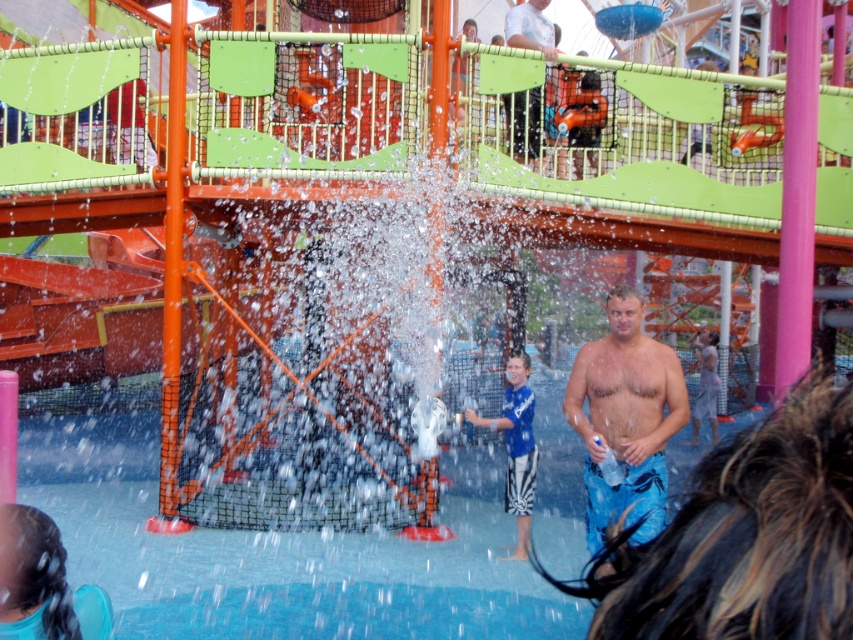
You are designing a storage box to hold both the blue fabric hair at lower left and the blue striped shorts at lower center. Which item requires a wider storage space?

The blue striped shorts at lower center requires a wider storage space because its width is greater than the blue fabric hair at lower left.

You are planning to place a new water slide in the water park scene. The slide requires a clear area of 1 meter by 1 meter. Given the location of the blue rubber pool at center, is there enough space to install the slide without overlapping the pool?

The blue rubber pool at center is located at coordinates point [280,552]. Since the slide requires a 1 meter by 1 meter space, and the pool is positioned at this specific point, there is sufficient space to place the slide nearby without overlapping, provided the coordinates allow for such placement.